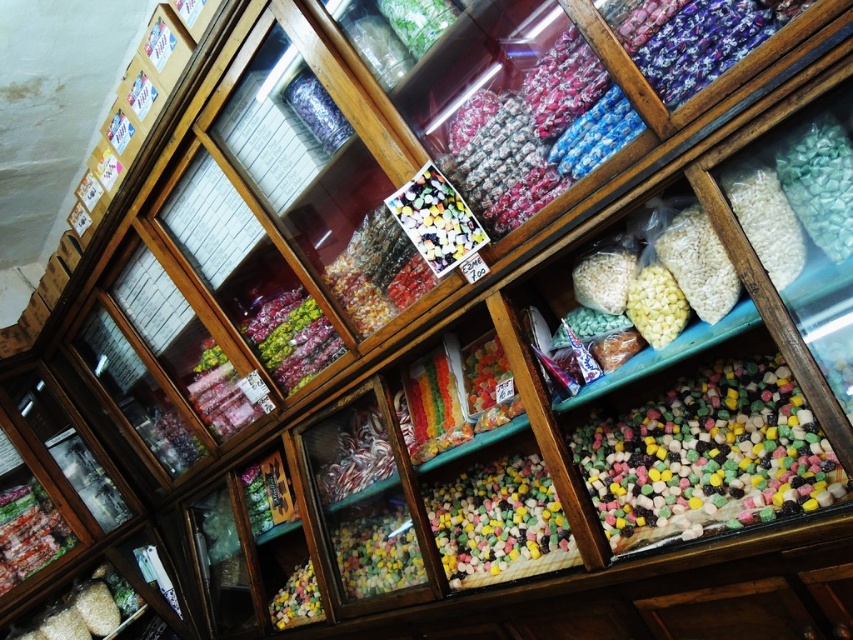
Does multicolored rubber at center have a greater width compared to translucent plastic candy at lower center?

Yes, multicolored rubber at center is wider than translucent plastic candy at lower center.

Between point (746, 368) and point (305, 620), which one is positioned behind?

The point (305, 620) is behind.

Where is `multicolored rubber at center`? multicolored rubber at center is located at coordinates (706, 458).

Does multicolored glossy candy at center come behind glossy plastic candy at center?

No, multicolored glossy candy at center is in front of glossy plastic candy at center.

The height and width of the screenshot is (640, 853). In order to click on multicolored glossy candy at center in this screenshot , I will do `click(376, 548)`.

What are the coordinates of `multicolored glossy candy at center` in the screenshot? It's located at (376, 548).

In the scene shown: Does multicolored rubber at center appear on the right side of multicolored glossy candy at center?

Yes, multicolored rubber at center is to the right of multicolored glossy candy at center.

Between point (682, 422) and point (364, 536), which one is positioned behind?

The point (364, 536) is behind.

Measure the distance between multicolored rubber at center and camera.

A distance of 4.21 feet exists between multicolored rubber at center and camera.

This screenshot has width=853, height=640. What are the coordinates of `multicolored rubber at center` in the screenshot? It's located at (706, 458).